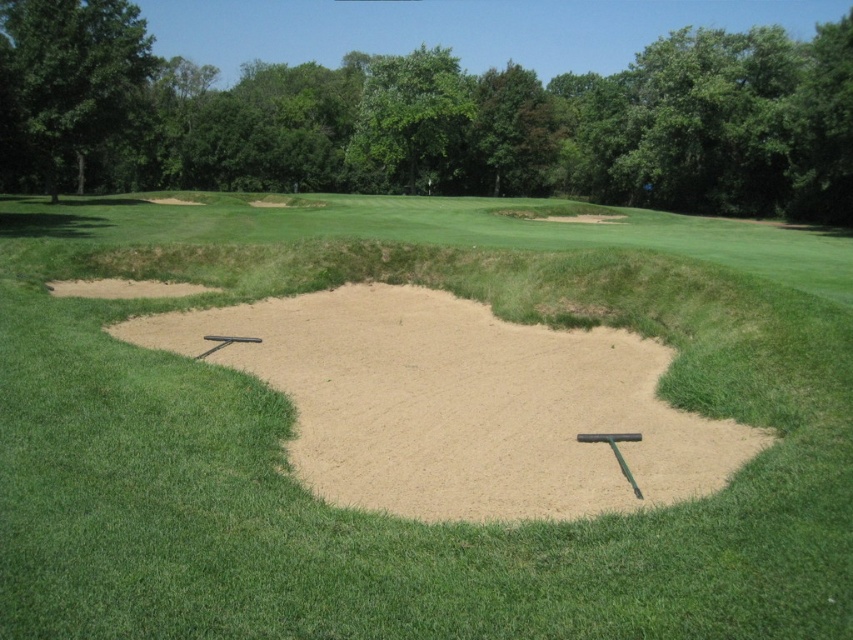
Is smooth sand trap at center further to camera compared to smooth sand at center?

No, smooth sand trap at center is closer to the viewer.

Is smooth sand trap at center smaller than smooth sand at center?

No, smooth sand trap at center is not smaller than smooth sand at center.

Is point (276, 568) farther from camera compared to point (656, 378)?

No.

I want to click on smooth sand trap at center, so click(x=387, y=516).